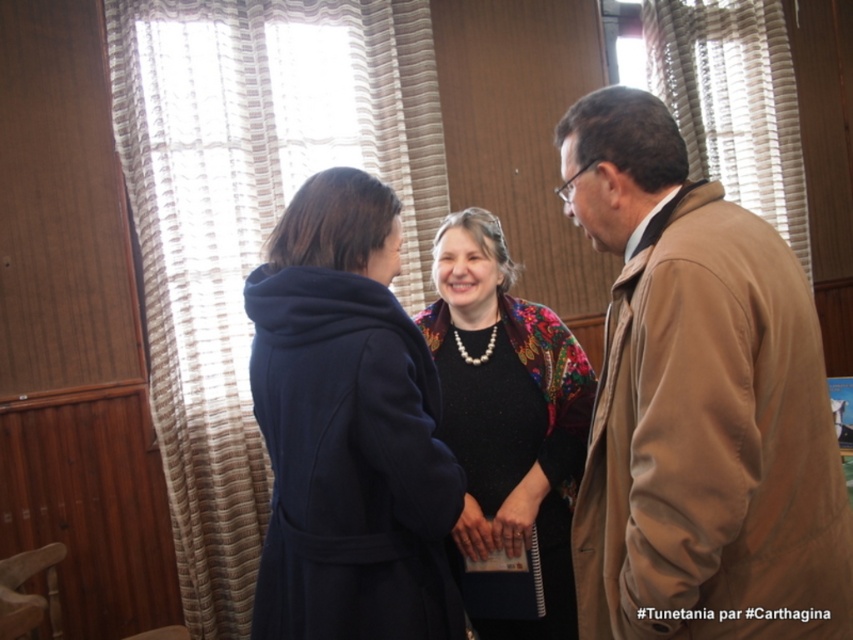
Which is more to the right, matte blue coat at center or floral-patterned fabric at center?

Positioned to the right is floral-patterned fabric at center.

Between matte blue coat at center and floral-patterned fabric at center, which one has more height?

floral-patterned fabric at center is taller.

Which is behind, point (283, 461) or point (532, 369)?

The point (532, 369) is behind.

This screenshot has height=640, width=853. What are the coordinates of `matte blue coat at center` in the screenshot? It's located at (347, 428).

Is dark blue wool coat at center to the left of floral-patterned fabric at center from the viewer's perspective?

Incorrect, dark blue wool coat at center is not on the left side of floral-patterned fabric at center.

Can you confirm if dark blue wool coat at center is taller than floral-patterned fabric at center?

Incorrect, dark blue wool coat at center's height is not larger of floral-patterned fabric at center's.

Does point (651, 310) lie in front of point (544, 371)?

Yes.

The width and height of the screenshot is (853, 640). I want to click on dark blue wool coat at center, so click(x=699, y=403).

Does point (576, 134) come farther from viewer compared to point (339, 284)?

No, (576, 134) is in front of (339, 284).

Is tan leather jacket at right smaller than matte blue coat at center?

Actually, tan leather jacket at right might be larger than matte blue coat at center.

Is point (735, 460) less distant than point (408, 602)?

Yes.

Find the location of a particular element. The width and height of the screenshot is (853, 640). tan leather jacket at right is located at coordinates (698, 404).